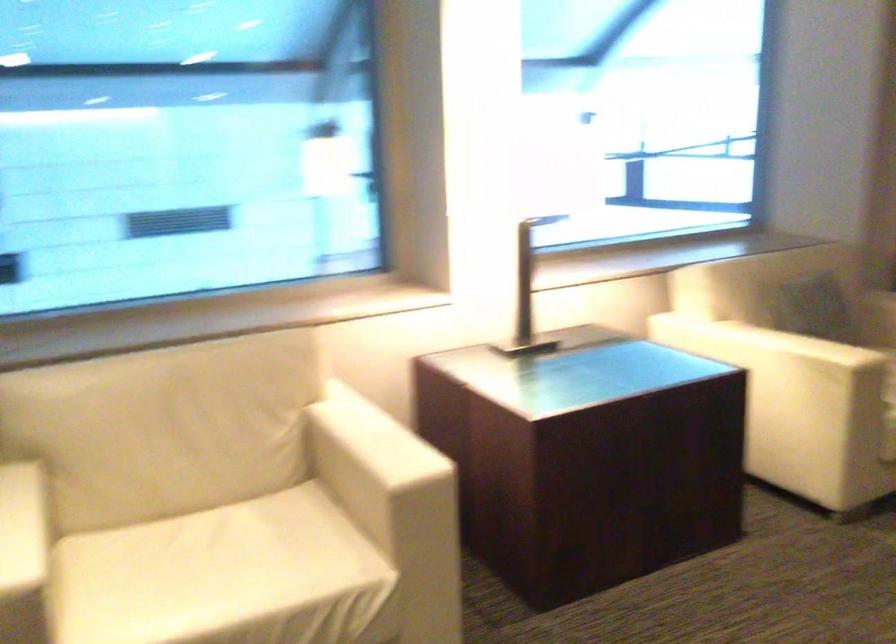
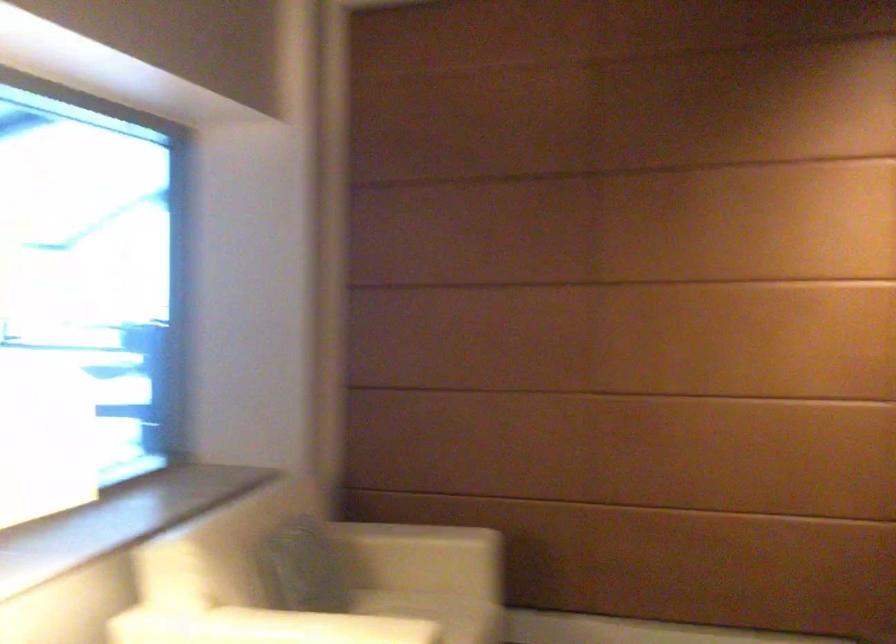
Question: The camera is either moving clockwise (left) or counter-clockwise (right) around the object. The first image is from the beginning of the video and the second image is from the end. Is the camera moving left or right when shooting the video?

Choices:
 (A) Left
 (B) Right

Answer: (A)